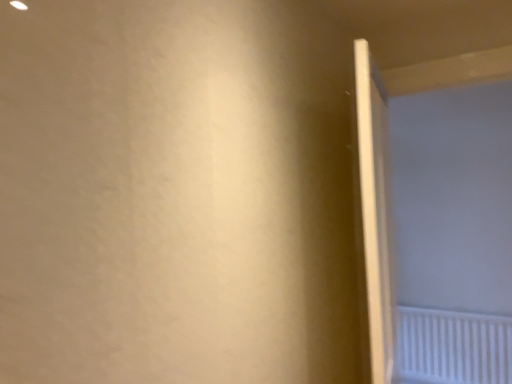
Question: Can white plastic radiator at lower right be found inside white matte screen door at right?

Choices:
 (A) no
 (B) yes

Answer: (A)

Question: Does white matte screen door at right have a smaller size compared to white plastic radiator at lower right?

Choices:
 (A) yes
 (B) no

Answer: (B)

Question: Is white matte screen door at right closer to camera compared to white plastic radiator at lower right?

Choices:
 (A) no
 (B) yes

Answer: (B)

Question: Is white matte screen door at right to the right of white plastic radiator at lower right from the viewer's perspective?

Choices:
 (A) yes
 (B) no

Answer: (B)

Question: From the image's perspective, is white matte screen door at right on top of white plastic radiator at lower right?

Choices:
 (A) no
 (B) yes

Answer: (B)

Question: Would you say white plastic radiator at lower right is to the left or to the right of white matte screen door at right in the picture?

Choices:
 (A) left
 (B) right

Answer: (B)

Question: From a real-world perspective, is white plastic radiator at lower right physically located above or below white matte screen door at right?

Choices:
 (A) above
 (B) below

Answer: (B)

Question: Considering the positions of white plastic radiator at lower right and white matte screen door at right in the image, is white plastic radiator at lower right taller or shorter than white matte screen door at right?

Choices:
 (A) short
 (B) tall

Answer: (A)

Question: In terms of width, does white plastic radiator at lower right look wider or thinner when compared to white matte screen door at right?

Choices:
 (A) thin
 (B) wide

Answer: (A)

Question: Considering the positions of white plastic radiator at lower right and white glossy door at right in the image, is white plastic radiator at lower right wider or thinner than white glossy door at right?

Choices:
 (A) thin
 (B) wide

Answer: (A)

Question: Considering the positions of point (412, 382) and point (360, 89), is point (412, 382) closer or farther from the camera than point (360, 89)?

Choices:
 (A) closer
 (B) farther

Answer: (B)

Question: From the image's perspective, is white plastic radiator at lower right positioned above or below white glossy door at right?

Choices:
 (A) above
 (B) below

Answer: (B)

Question: Would you say white plastic radiator at lower right is to the left or to the right of white glossy door at right in the picture?

Choices:
 (A) right
 (B) left

Answer: (A)

Question: Considering the positions of white glossy door at right and white matte screen door at right in the image, is white glossy door at right bigger or smaller than white matte screen door at right?

Choices:
 (A) small
 (B) big

Answer: (A)

Question: From their relative heights in the image, would you say white glossy door at right is taller or shorter than white matte screen door at right?

Choices:
 (A) tall
 (B) short

Answer: (B)